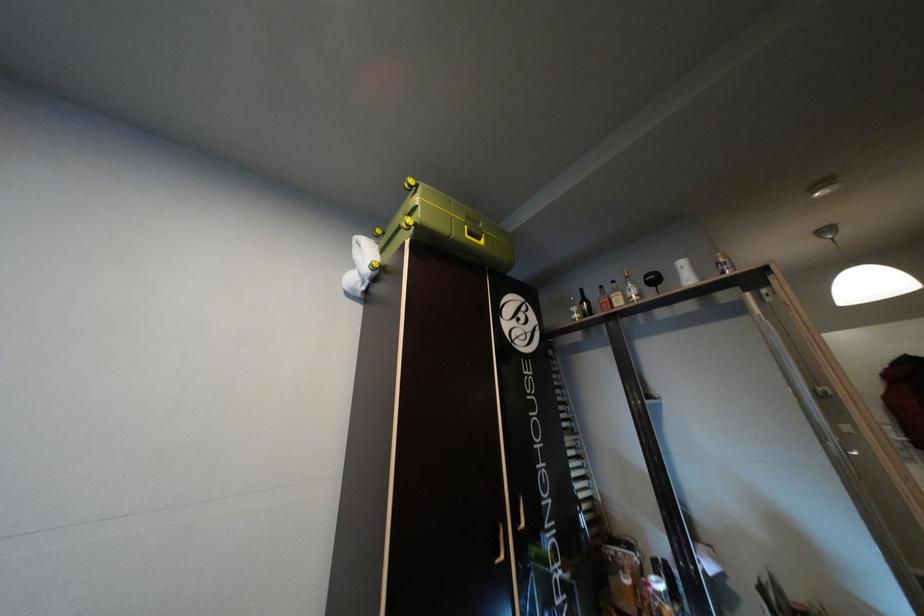
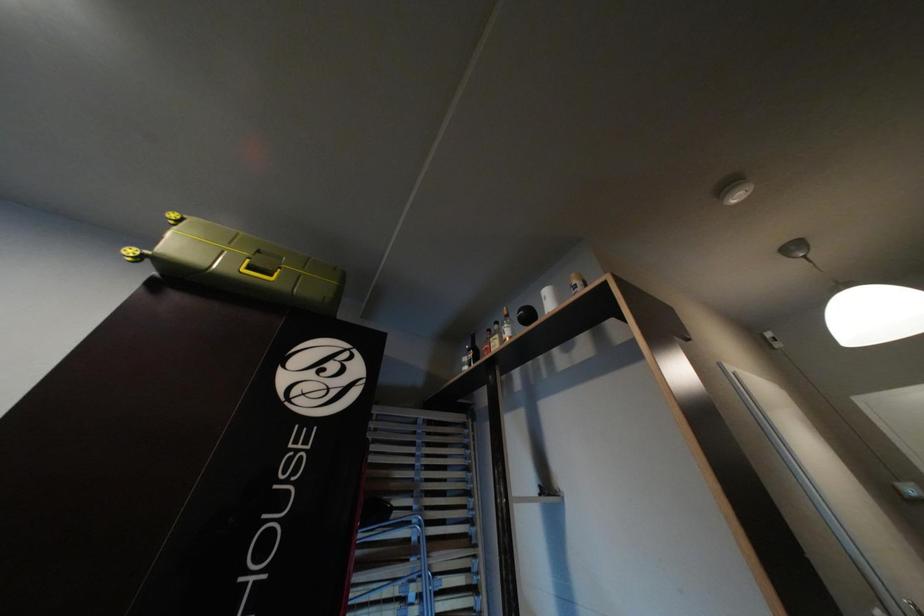
Question: Which direction would the cameraman need to move to produce the second image? Reply with the corresponding letter.

Choices:
 (A) Left
 (B) Right
 (C) Forward
 (D) Backward

Answer: (B)